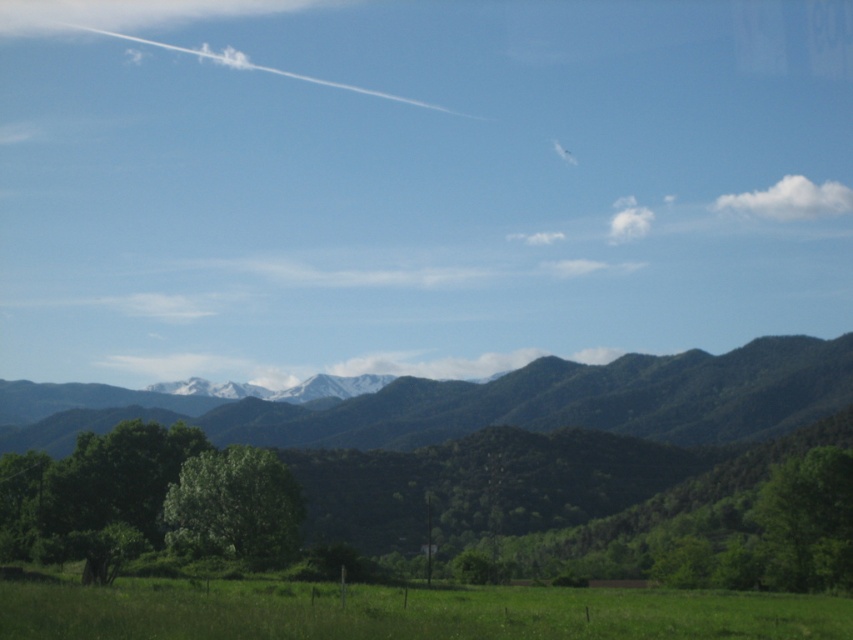
Question: Does green grassy field at lower center have a larger size compared to green leafy tree at lower left?

Choices:
 (A) no
 (B) yes

Answer: (B)

Question: Which of the following is the closest to the observer?

Choices:
 (A) (685, 451)
 (B) (636, 612)
 (C) (776, 467)

Answer: (B)

Question: Can you confirm if green grassy field at lower center is thinner than green leafy tree at lower left?

Choices:
 (A) no
 (B) yes

Answer: (A)

Question: Is green leafy tree at lower left in front of green leafy tree at lower right?

Choices:
 (A) no
 (B) yes

Answer: (B)

Question: Among these points, which one is nearest to the camera?

Choices:
 (A) (822, 509)
 (B) (587, 442)
 (C) (339, 616)

Answer: (C)

Question: Which object is positioned closest to the green leafy tree at lower right?

Choices:
 (A) green leafy tree at lower left
 (B) green leafy forest at center
 (C) green grassy field at lower center
 (D) green leafy mountains at center

Answer: (A)